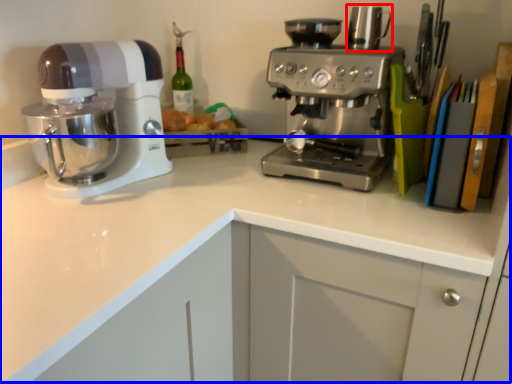
Question: Among these objects, which one is farthest to the camera, appliance (highlighted by a red box) or counter top (highlighted by a blue box)?

Choices:
 (A) appliance
 (B) counter top

Answer: (A)